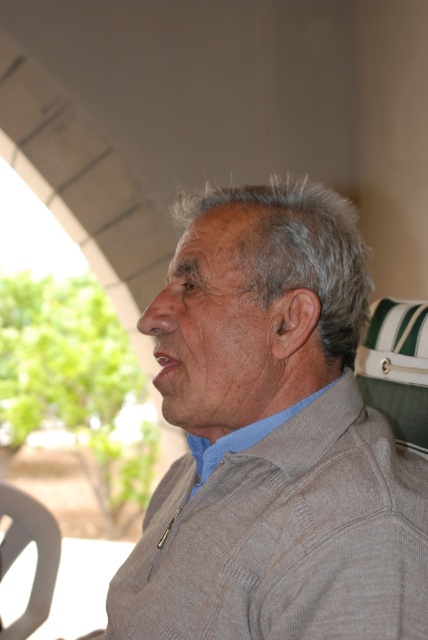
Is point (113, 620) behind point (192, 440)?

That is False.

Is point (237, 605) behind point (196, 456)?

That is False.

The height and width of the screenshot is (640, 428). Find the location of `gray knitted sweater at center`. gray knitted sweater at center is located at coordinates (272, 436).